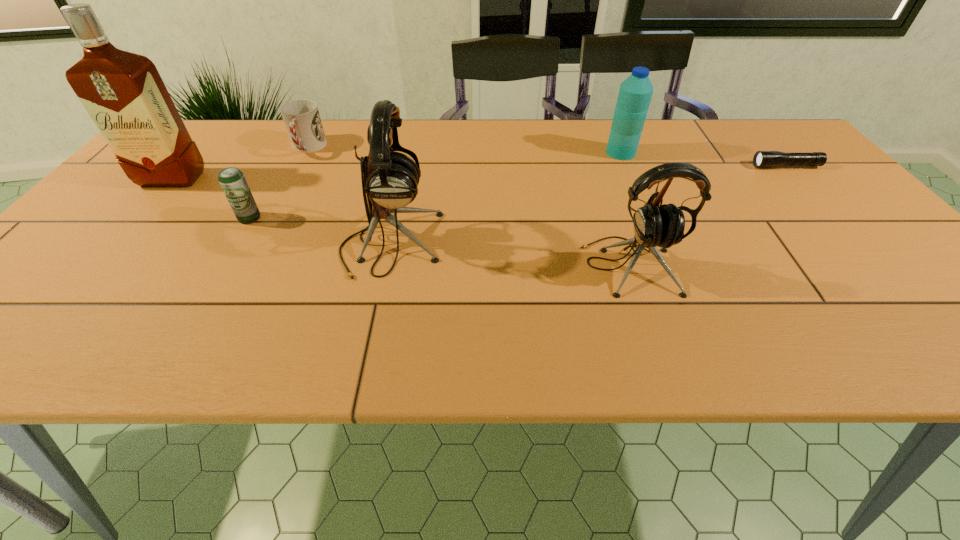
This screenshot has height=540, width=960. Identify the location of free space that satisfies the following two spatial constraints: 1. on the back side of the beer can; 2. on the right side of the water bottle. (288, 153).

This screenshot has width=960, height=540. What are the coordinates of `vacant position in the image that satisfies the following two spatial constraints: 1. on the front side of the beer can; 2. on the right side of the left earphone` in the screenshot? It's located at (235, 244).

The height and width of the screenshot is (540, 960). I want to click on vacant position in the image that satisfies the following two spatial constraints: 1. on the side of the water bottle where the handle is located; 2. on the right side of the cup, so click(x=305, y=153).